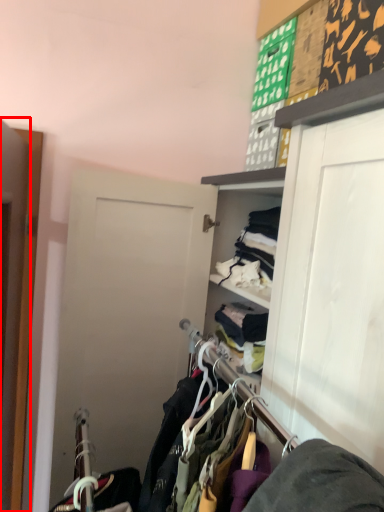
Question: From the image's perspective, considering the relative positions of door (annotated by the red box) and closet in the image provided, where is door (annotated by the red box) located with respect to the staircase?

Choices:
 (A) below
 (B) above

Answer: (B)